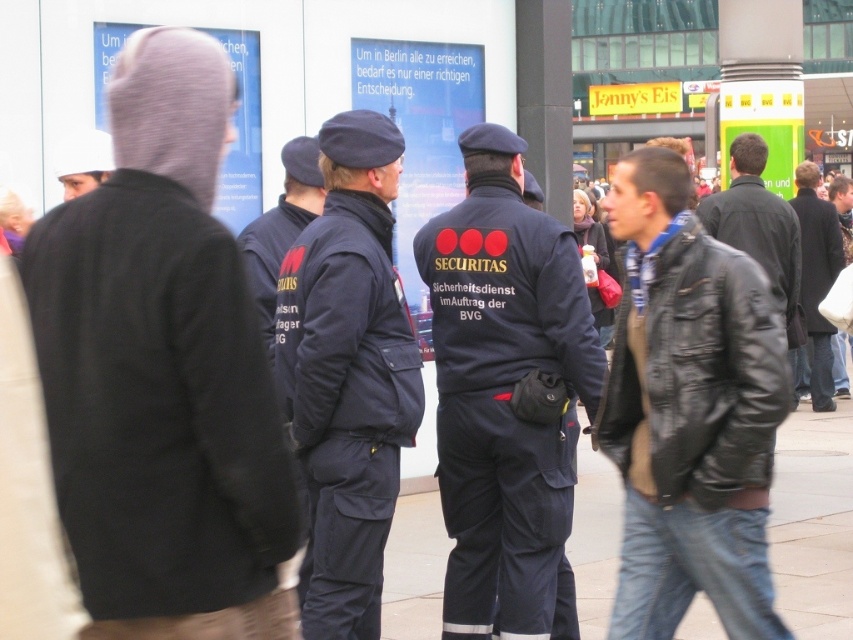
Does dark blue uniform at center appear on the right side of black leather jacket at right?

No, dark blue uniform at center is not to the right of black leather jacket at right.

Does dark blue uniform at center appear under black leather jacket at right?

Yes.

Is point (495, 124) positioned before point (778, 244)?

That is True.

Locate an element on the screen. Image resolution: width=853 pixels, height=640 pixels. dark blue uniform at center is located at coordinates (506, 396).

Is knit gray beanie at upper left further to the viewer compared to black leather jacket at right?

No, knit gray beanie at upper left is in front of black leather jacket at right.

From the picture: Is knit gray beanie at upper left positioned in front of black leather jacket at right?

Yes, it is.

Does point (207, 470) come farther from viewer compared to point (706, 230)?

No, it is not.

Where is `knit gray beanie at upper left`? This screenshot has height=640, width=853. knit gray beanie at upper left is located at coordinates (161, 371).

Can you confirm if leather jacket at center is thinner than white fabric cap at upper left?

No, leather jacket at center is not thinner than white fabric cap at upper left.

Between leather jacket at center and white fabric cap at upper left, which one appears on the left side from the viewer's perspective?

From the viewer's perspective, white fabric cap at upper left appears more on the left side.

Who is more distant from viewer, [741,632] or [73,193]?

Point [73,193]

At what (x,y) coordinates should I click in order to perform the action: click on leather jacket at center. Please return your answer as a coordinate pair (x, y). Looking at the image, I should click on (689, 412).